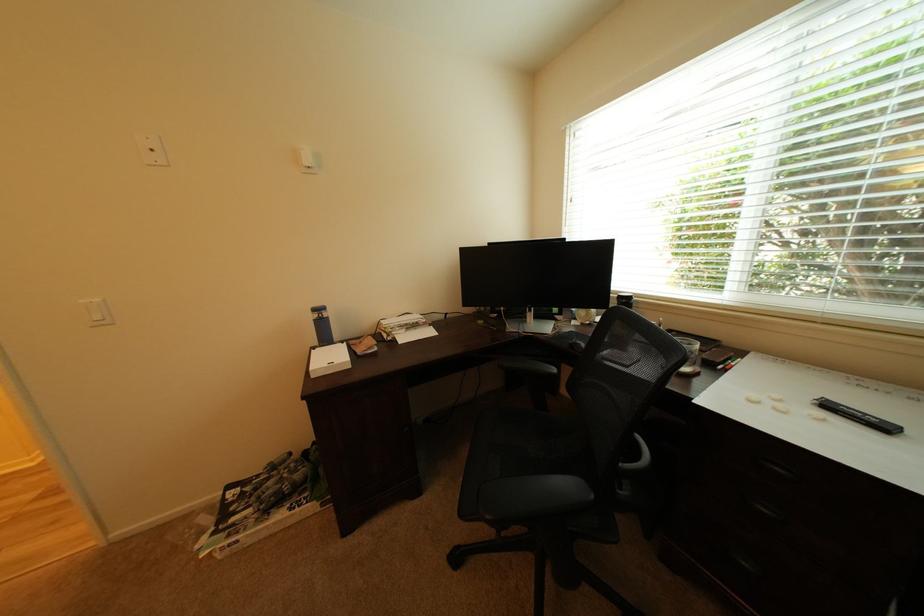
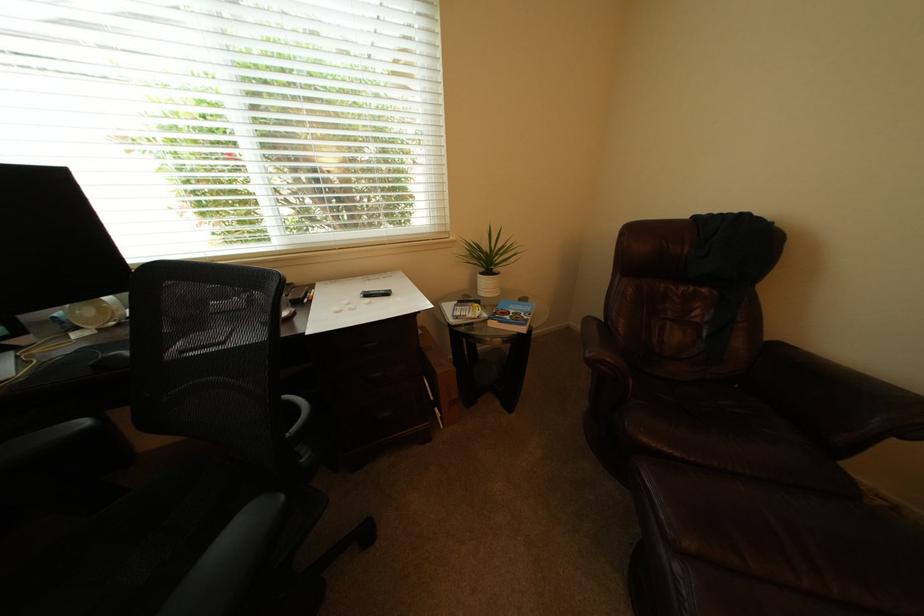
Locate, in the second image, the point that corresponds to the point at 840,408 in the first image.

(378, 297)